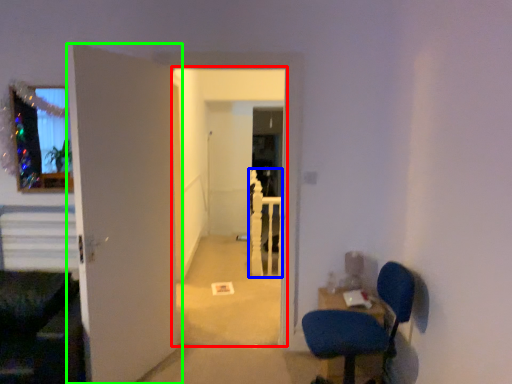
Question: Which object is positioned closest to corridor (highlighted by a red box)? Select from rail (highlighted by a blue box) and door (highlighted by a green box).

Choices:
 (A) rail
 (B) door

Answer: (A)